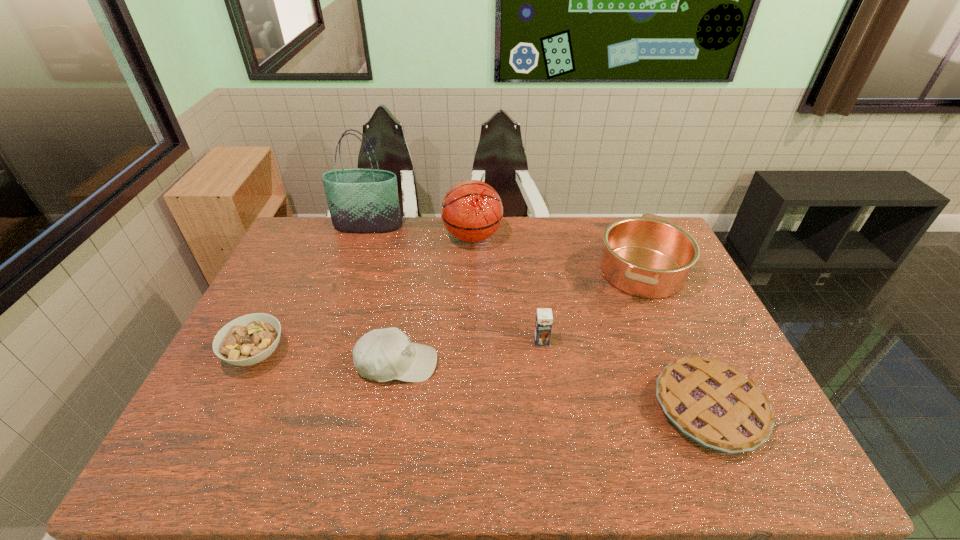
Locate an element on the screen. The height and width of the screenshot is (540, 960). vacant space situated on the front label of the chocolate milk is located at coordinates (549, 396).

Find the location of a particular element. The height and width of the screenshot is (540, 960). free space located on the front-facing side of the baseball cap is located at coordinates (475, 364).

I want to click on vacant area situated 0.320m on the right of the stew, so click(x=405, y=354).

Find the location of a particular element. The image size is (960, 540). free spot located on the left of the shortest object is located at coordinates 580,409.

Where is `tote bag that is at the far edge`? The image size is (960, 540). tote bag that is at the far edge is located at coordinates (360, 200).

Image resolution: width=960 pixels, height=540 pixels. What are the coordinates of `basketball present at the far edge` in the screenshot? It's located at (472, 211).

Identify the location of saucepan positioned at the far edge. (649, 257).

Locate an element on the screen. The width and height of the screenshot is (960, 540). object located at the near edge is located at coordinates (715, 405).

At what (x,y) coordinates should I click in order to perform the action: click on tote bag located in the left edge section of the desktop. Please return your answer as a coordinate pair (x, y). The image size is (960, 540). Looking at the image, I should click on (360, 200).

Find the location of a particular element. This screenshot has width=960, height=540. stew at the left edge is located at coordinates (247, 340).